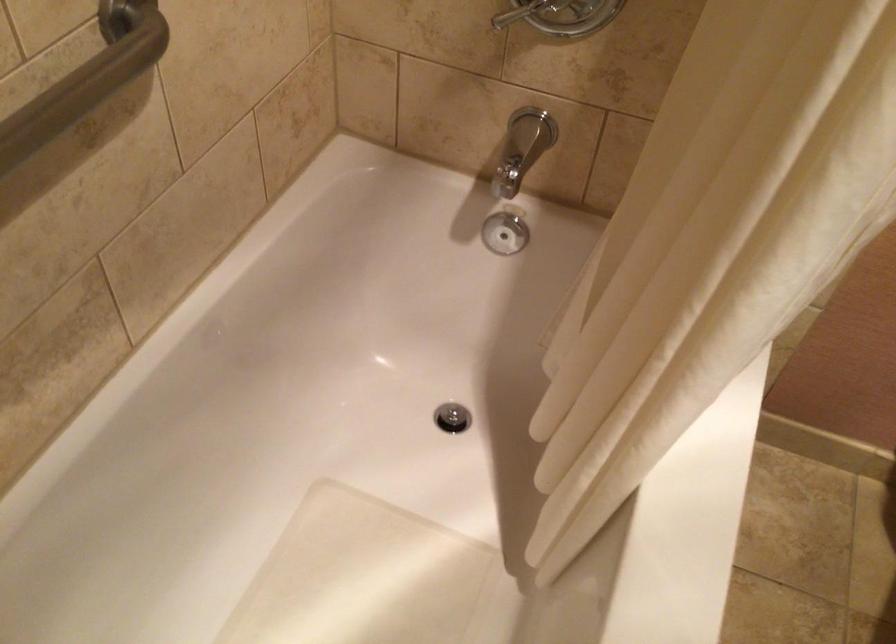
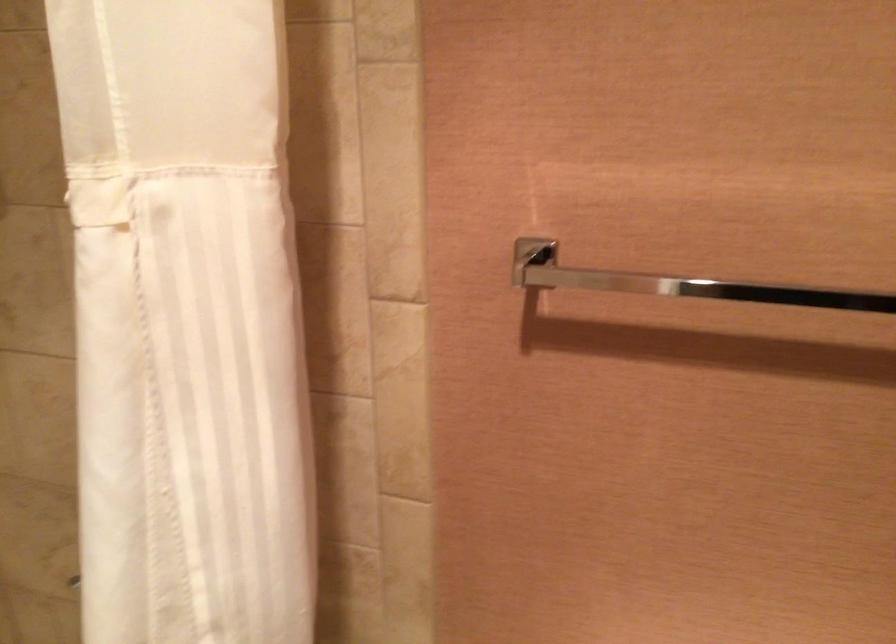
Question: The first image is from the beginning of the video and the second image is from the end. How did the camera likely rotate when shooting the video?

Choices:
 (A) Left
 (B) Right
 (C) Up
 (D) Down

Answer: (C)